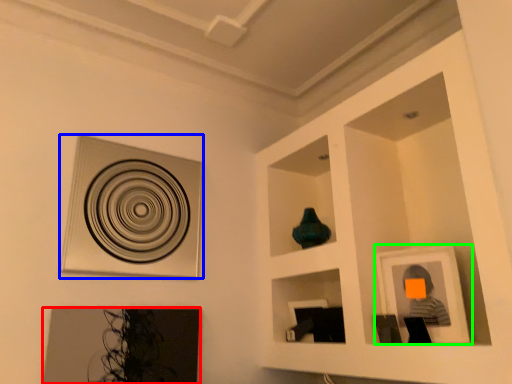
Question: Considering the real-world distances, which object is farthest from picture frame (highlighted by a red box)? picture frame (highlighted by a blue box) or picture frame (highlighted by a green box)?

Choices:
 (A) picture frame
 (B) picture frame

Answer: (B)